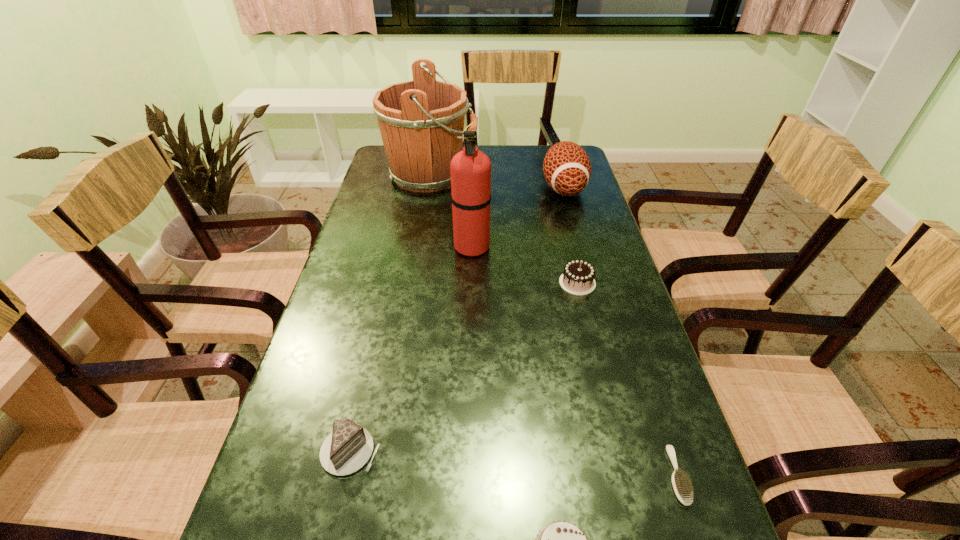
Where is `vacant region between the third farthest object and the bucket`? Image resolution: width=960 pixels, height=540 pixels. vacant region between the third farthest object and the bucket is located at coordinates (451, 211).

This screenshot has width=960, height=540. What are the coordinates of `vacant space in between the scrubbing brush and the football` in the screenshot? It's located at click(620, 332).

You are a GUI agent. You are given a task and a screenshot of the screen. Output one action in this format:
    pyautogui.click(x=<x>, y=<y>)
    Task: Click on the unoccupied position between the football and the fourth tallest object
    This screenshot has width=960, height=540.
    Given the screenshot: What is the action you would take?
    pyautogui.click(x=570, y=235)

This screenshot has width=960, height=540. I want to click on empty space that is in between the fire extinguisher and the football, so click(x=517, y=217).

Locate an element on the screen. This screenshot has height=540, width=960. the closest object relative to the third farthest object is located at coordinates (419, 121).

Locate an element on the screen. Image resolution: width=960 pixels, height=540 pixels. the fifth closest object to the second chocolate cake from right to left is located at coordinates (567, 169).

Select which chocolate cake is the second closest to the farthest chocolate cake. Please provide its 2D coordinates. Your answer should be formatted as a tuple, i.e. [(x, y)], where the tuple contains the x and y coordinates of a point satisfying the conditions above.

[(348, 448)]

The height and width of the screenshot is (540, 960). What are the coordinates of `chocolate cake that is the second closest to the fourth farthest object` in the screenshot? It's located at (348, 448).

Where is `free location that satisfies the following two spatial constraints: 1. at the nozzle of the fire extinguisher; 2. on the right side of the scrubbing brush`? free location that satisfies the following two spatial constraints: 1. at the nozzle of the fire extinguisher; 2. on the right side of the scrubbing brush is located at coordinates (467, 475).

Identify the location of vacant point that satisfies the following two spatial constraints: 1. on the back side of the farthest chocolate cake; 2. with the handle on the side of the bucket. (551, 175).